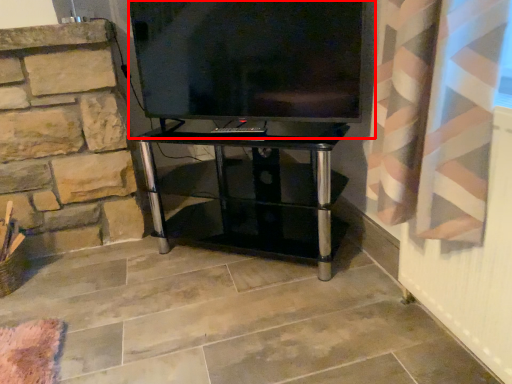
Question: Where is television (annotated by the red box) located in relation to furniture in the image?

Choices:
 (A) left
 (B) right

Answer: (B)